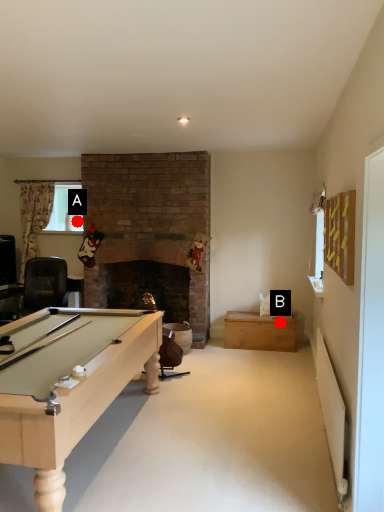
Question: Two points are circled on the image, labeled by A and B beside each circle. Among these points, which one is nearest to the camera?

Choices:
 (A) A is closer
 (B) B is closer

Answer: (B)